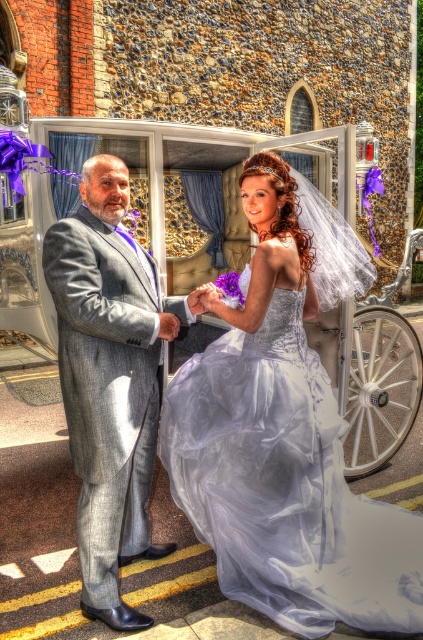
You are a photographer at a wedding. You need to capture a photo of the silvery tulle dress at center and the gray wool suit at center. Which one of the two should you focus on first if you want to highlight the larger one in your composition?

The silvery tulle dress at center has a larger size compared to gray wool suit at center, so you should focus on the silvery tulle dress at center first to highlight its larger size in the composition.

You are a photographer at the wedding and need to position the silvery tulle dress at center and the white wood cart at center in your shot. Which object takes up more space in the photo?

The silvery tulle dress at center has a larger size compared to the white wood cart at center, so it takes up more space in the photo.